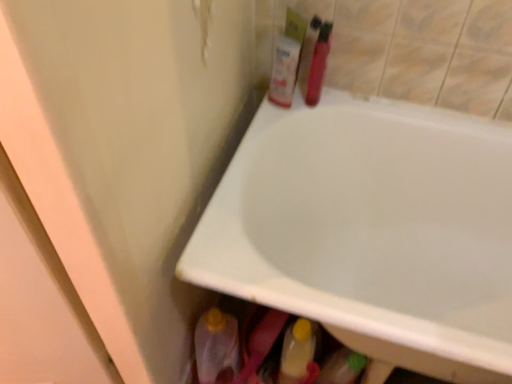
Question: Considering the relative positions of translucent plastic bottle at upper center, positioned as the first toiletry in left-to-right order, and white glossy bathtub at upper center in the image provided, is translucent plastic bottle at upper center, positioned as the first toiletry in left-to-right order, to the left or to the right of white glossy bathtub at upper center?

Choices:
 (A) right
 (B) left

Answer: (B)

Question: Choose the correct answer: Is translucent plastic bottle at upper center, which is the 2th toiletry from right to left, inside white glossy bathtub at upper center or outside it?

Choices:
 (A) inside
 (B) outside

Answer: (B)

Question: Which object is positioned farthest from the white glossy bathtub at upper center?

Choices:
 (A) translucent plastic bottle at upper center, positioned as the first toiletry in left-to-right order
 (B) shiny plastic bottle at upper right, which ranks as the 1th toiletry in right-to-left order
 (C) yellow cap plastic bottle at lower center

Answer: (B)

Question: Based on their relative distances, which object is nearer to the yellow cap plastic bottle at lower center?

Choices:
 (A) white glossy bathtub at upper center
 (B) translucent plastic bottle at upper center, positioned as the first toiletry in left-to-right order
 (C) shiny plastic bottle at upper right, placed as the second toiletry when sorted from left to right

Answer: (A)